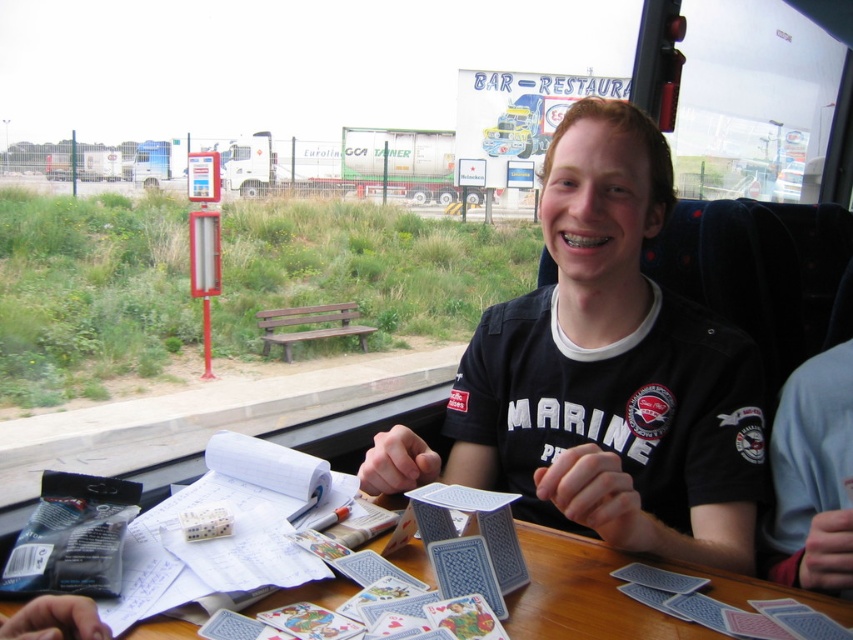
Please describe the exact location of the blue glossy playing cards at center in the image using coordinate points. The coordinate system has the origin at the bottom left corner of the image, with the x and y axes increasing to the right and up respectively. The coordinates are normalized between 0 and 1. Please provide the coordinates as a tuple of two decimal numbers rounded to three decimal places.

The blue glossy playing cards at center are located at coordinate point [602,374].

You are sitting on the bus and want to pick up the blue glossy playing cards at center. Can you reach them without moving your blue fabric shirt at right?

The blue glossy playing cards at center are further away from you than the blue fabric shirt at right. Since the cards are farther, you might need to adjust your position to reach them without moving the shirt.

In the scene shown: You are a passenger on a bus and see the blue glossy playing cards at center and the blue plastic table at center. Which object is positioned higher relative to the other?

The blue glossy playing cards at center are positioned above the blue plastic table at center.